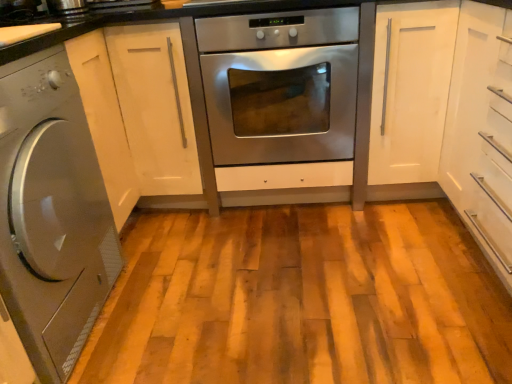
The width and height of the screenshot is (512, 384). Describe the element at coordinates (51, 214) in the screenshot. I see `satin silver washing machine at left` at that location.

How much space does white matte cabinet at right, which is counted as the 2th cabinetry, starting from the left, occupy horizontally?

white matte cabinet at right, which is counted as the 2th cabinetry, starting from the left, is 15.60 inches in width.

You are a GUI agent. You are given a task and a screenshot of the screen. Output one action in this format:
    pyautogui.click(x=<x>, y=<y>)
    Task: Click on the white glossy cabinet at center, which is counted as the first cabinetry, starting from the left
    
    Given the screenshot: What is the action you would take?
    pyautogui.click(x=138, y=111)

Is satin silver washing machine at left oriented away from stainless steel oven at center?

No, satin silver washing machine at left is not facing the opposite direction of stainless steel oven at center.

From the image's perspective, between satin silver washing machine at left and stainless steel oven at center, who is located below?

satin silver washing machine at left appears lower in the image.

From a real-world perspective, between satin silver washing machine at left and stainless steel oven at center, who is vertically higher?

satin silver washing machine at left, from a real-world perspective.

Looking at their sizes, would you say satin silver washing machine at left is wider or thinner than stainless steel oven at center?

Clearly, satin silver washing machine at left has less width compared to stainless steel oven at center.

Considering the sizes of stainless steel oven at center and white glossy cabinet at center, arranged as the second cabinetry when viewed from the right, in the image, is stainless steel oven at center taller or shorter than white glossy cabinet at center, arranged as the second cabinetry when viewed from the right,?

Considering their sizes, stainless steel oven at center has less height than white glossy cabinet at center, arranged as the second cabinetry when viewed from the right.

Can white glossy cabinet at center, arranged as the second cabinetry when viewed from the right, be found inside stainless steel oven at center?

No, white glossy cabinet at center, arranged as the second cabinetry when viewed from the right, is not surrounded by stainless steel oven at center.

Relative to white glossy cabinet at center, arranged as the second cabinetry when viewed from the right, is stainless steel oven at center in front or behind?

In the image, stainless steel oven at center appears in front of white glossy cabinet at center, arranged as the second cabinetry when viewed from the right.

In the scene shown: Between stainless steel oven at center and white glossy cabinet at center, arranged as the second cabinetry when viewed from the right, which one appears on the right side from the viewer's perspective?

Positioned to the right is stainless steel oven at center.

How far apart are stainless steel oven at center and white matte cabinet at right, the 1th cabinetry from the right?

stainless steel oven at center and white matte cabinet at right, the 1th cabinetry from the right, are 14.29 inches apart from each other.

Which of these two, stainless steel oven at center or white matte cabinet at right, which is counted as the 2th cabinetry, starting from the left, stands shorter?

Standing shorter between the two is stainless steel oven at center.

Does stainless steel oven at center touch white matte cabinet at right, the 1th cabinetry from the right?

No, stainless steel oven at center is not touching white matte cabinet at right, the 1th cabinetry from the right.

Which object is thinner, stainless steel oven at center or white matte cabinet at right, the 1th cabinetry from the right?

With smaller width is white matte cabinet at right, the 1th cabinetry from the right.

Which of these two, white matte cabinet at right, the 1th cabinetry from the right, or stainless steel oven at center, stands shorter?

With less height is stainless steel oven at center.

Is white matte cabinet at right, the 1th cabinetry from the right, looking in the opposite direction of stainless steel oven at center?

That's not correct — white matte cabinet at right, the 1th cabinetry from the right, is not looking away from stainless steel oven at center.

From the image's perspective, is white matte cabinet at right, which is counted as the 2th cabinetry, starting from the left, positioned above or below stainless steel oven at center?

Clearly, from the image's perspective, white matte cabinet at right, which is counted as the 2th cabinetry, starting from the left, is below stainless steel oven at center.

Considering the relative positions of white matte cabinet at right, which is counted as the 2th cabinetry, starting from the left, and stainless steel oven at center in the image provided, is white matte cabinet at right, which is counted as the 2th cabinetry, starting from the left, to the left of stainless steel oven at center from the viewer's perspective?

Incorrect, white matte cabinet at right, which is counted as the 2th cabinetry, starting from the left, is not on the left side of stainless steel oven at center.

Is white matte cabinet at right, the 1th cabinetry from the right, not within satin silver washing machine at left?

Yes, white matte cabinet at right, the 1th cabinetry from the right, is outside of satin silver washing machine at left.

Between white matte cabinet at right, which is counted as the 2th cabinetry, starting from the left, and satin silver washing machine at left, which one has less height?

Standing shorter between the two is satin silver washing machine at left.

Does white matte cabinet at right, the 1th cabinetry from the right, have a larger size compared to satin silver washing machine at left?

Incorrect, white matte cabinet at right, the 1th cabinetry from the right, is not larger than satin silver washing machine at left.

In the image, is white matte cabinet at right, which is counted as the 2th cabinetry, starting from the left, positioned in front of or behind satin silver washing machine at left?

In the image, white matte cabinet at right, which is counted as the 2th cabinetry, starting from the left, appears behind satin silver washing machine at left.

Considering the points (390, 31) and (192, 114), which point is behind, point (390, 31) or point (192, 114)?

Point (192, 114)

Is white glossy cabinet at center, arranged as the second cabinetry when viewed from the right, at the back of white matte cabinet at right, which is counted as the 2th cabinetry, starting from the left?

white matte cabinet at right, which is counted as the 2th cabinetry, starting from the left, does not have its back to white glossy cabinet at center, arranged as the second cabinetry when viewed from the right.

In terms of width, does white matte cabinet at right, which is counted as the 2th cabinetry, starting from the left, look wider or thinner when compared to white glossy cabinet at center, which is counted as the first cabinetry, starting from the left?

white matte cabinet at right, which is counted as the 2th cabinetry, starting from the left, is thinner than white glossy cabinet at center, which is counted as the first cabinetry, starting from the left.

Considering the relative sizes of white matte cabinet at right, which is counted as the 2th cabinetry, starting from the left, and white glossy cabinet at center, which is counted as the first cabinetry, starting from the left, in the image provided, is white matte cabinet at right, which is counted as the 2th cabinetry, starting from the left, taller than white glossy cabinet at center, which is counted as the first cabinetry, starting from the left,?

No.

Consider the image. Is satin silver washing machine at left with white glossy cabinet at center, arranged as the second cabinetry when viewed from the right?

No, satin silver washing machine at left is not in contact with white glossy cabinet at center, arranged as the second cabinetry when viewed from the right.

Looking at this image, is satin silver washing machine at left at the left side of white glossy cabinet at center, which is counted as the first cabinetry, starting from the left?

Yes.

Based on the photo, is satin silver washing machine at left surrounding white glossy cabinet at center, which is counted as the first cabinetry, starting from the left?

No, white glossy cabinet at center, which is counted as the first cabinetry, starting from the left, is not inside satin silver washing machine at left.

I want to click on oven located on the right of satin silver washing machine at left, so click(280, 85).

Find the location of a particular element. The height and width of the screenshot is (384, 512). oven below the white glossy cabinet at center, arranged as the second cabinetry when viewed from the right (from a real-world perspective) is located at coordinates (280, 85).

Which object lies further to the anchor point satin silver washing machine at left, white glossy cabinet at center, arranged as the second cabinetry when viewed from the right, or stainless steel oven at center?

Based on the image, stainless steel oven at center appears to be further to satin silver washing machine at left.

Based on their spatial positions, is white matte cabinet at right, the 1th cabinetry from the right, or white glossy cabinet at center, which is counted as the first cabinetry, starting from the left, closer to satin silver washing machine at left?

white glossy cabinet at center, which is counted as the first cabinetry, starting from the left, is closer to satin silver washing machine at left.

Looking at the image, which one is located closer to satin silver washing machine at left, white glossy cabinet at center, arranged as the second cabinetry when viewed from the right, or white matte cabinet at right, which is counted as the 2th cabinetry, starting from the left?

white glossy cabinet at center, arranged as the second cabinetry when viewed from the right, is positioned closer to the anchor satin silver washing machine at left.

Based on their spatial positions, is white glossy cabinet at center, which is counted as the first cabinetry, starting from the left, or satin silver washing machine at left closer to stainless steel oven at center?

white glossy cabinet at center, which is counted as the first cabinetry, starting from the left, lies closer to stainless steel oven at center than the other object.

From the image, which object appears to be nearer to white glossy cabinet at center, which is counted as the first cabinetry, starting from the left, satin silver washing machine at left or stainless steel oven at center?

stainless steel oven at center is positioned closer to the anchor white glossy cabinet at center, which is counted as the first cabinetry, starting from the left.

Considering their positions, is satin silver washing machine at left positioned further to white matte cabinet at right, the 1th cabinetry from the right, than white glossy cabinet at center, arranged as the second cabinetry when viewed from the right?

satin silver washing machine at left lies further to white matte cabinet at right, the 1th cabinetry from the right, than the other object.

From the image, which object appears to be farther from satin silver washing machine at left, stainless steel oven at center or white matte cabinet at right, which is counted as the 2th cabinetry, starting from the left?

white matte cabinet at right, which is counted as the 2th cabinetry, starting from the left, is further to satin silver washing machine at left.

When comparing their distances from white matte cabinet at right, which is counted as the 2th cabinetry, starting from the left, does stainless steel oven at center or satin silver washing machine at left seem further?

satin silver washing machine at left is positioned further to the anchor white matte cabinet at right, which is counted as the 2th cabinetry, starting from the left.

The height and width of the screenshot is (384, 512). Find the location of `oven between white glossy cabinet at center, arranged as the second cabinetry when viewed from the right, and white matte cabinet at right, which is counted as the 2th cabinetry, starting from the left, from left to right`. oven between white glossy cabinet at center, arranged as the second cabinetry when viewed from the right, and white matte cabinet at right, which is counted as the 2th cabinetry, starting from the left, from left to right is located at coordinates (280, 85).

What are the coordinates of `oven located between satin silver washing machine at left and white matte cabinet at right, the 1th cabinetry from the right, in the left-right direction` in the screenshot? It's located at (280, 85).

Image resolution: width=512 pixels, height=384 pixels. Find the location of `cabinetry between satin silver washing machine at left and white matte cabinet at right, which is counted as the 2th cabinetry, starting from the left, in the horizontal direction`. cabinetry between satin silver washing machine at left and white matte cabinet at right, which is counted as the 2th cabinetry, starting from the left, in the horizontal direction is located at coordinates (138, 111).

This screenshot has height=384, width=512. Identify the location of cabinetry located between satin silver washing machine at left and stainless steel oven at center in the left-right direction. (138, 111).